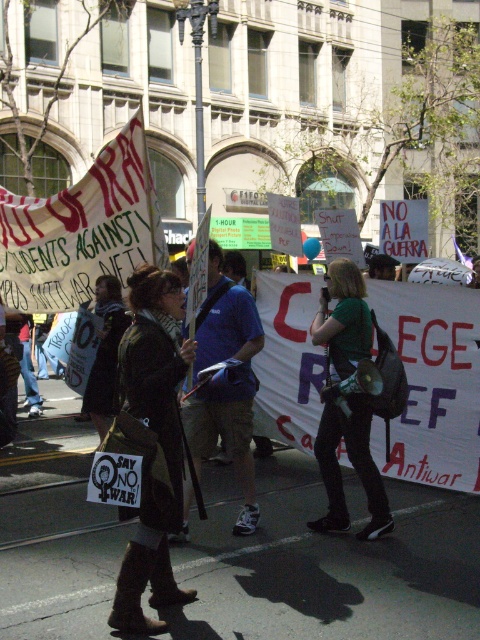
In the scene shown: Can you confirm if dark brown leather boots at center is smaller than blue fabric shirt at center?

Yes.

Does dark brown leather boots at center have a greater height compared to blue fabric shirt at center?

In fact, dark brown leather boots at center may be shorter than blue fabric shirt at center.

The height and width of the screenshot is (640, 480). Find the location of `dark brown leather boots at center`. dark brown leather boots at center is located at coordinates (152, 444).

Can you confirm if dark brown leather boots at center is positioned to the left of green matte shirt at center?

Indeed, dark brown leather boots at center is positioned on the left side of green matte shirt at center.

Who is taller, dark brown leather boots at center or green matte shirt at center?

With more height is green matte shirt at center.

You are a GUI agent. You are given a task and a screenshot of the screen. Output one action in this format:
    pyautogui.click(x=<x>, y=<y>)
    Task: Click on the dark brown leather boots at center
    The width and height of the screenshot is (480, 640).
    Given the screenshot: What is the action you would take?
    pyautogui.click(x=152, y=444)

I want to click on dark brown leather boots at center, so click(152, 444).

Does blue fabric shirt at center appear over green matte shirt at center?

Yes.

Which is below, blue fabric shirt at center or green matte shirt at center?

green matte shirt at center is lower down.

Which is in front, point (188, 422) or point (369, 481)?

Point (369, 481) is more forward.

This screenshot has width=480, height=640. What are the coordinates of `blue fabric shirt at center` in the screenshot? It's located at (226, 381).